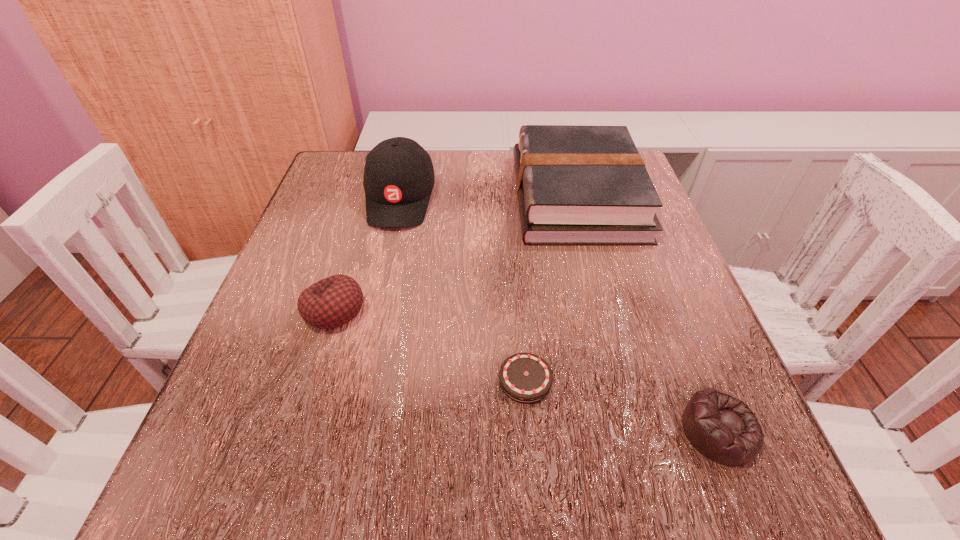
Where is `beanbag present at the right edge`? The height and width of the screenshot is (540, 960). beanbag present at the right edge is located at coordinates (722, 428).

Locate an element on the screen. object that is at the far left corner is located at coordinates (x=398, y=180).

The image size is (960, 540). In order to click on object located at the far right corner in this screenshot , I will do `click(576, 185)`.

Identify the location of object that is at the near right corner. (722, 428).

Identify the location of blank space at the far edge of the desktop. The width and height of the screenshot is (960, 540). (461, 168).

Locate an element on the screen. Image resolution: width=960 pixels, height=540 pixels. vacant space at the near edge is located at coordinates (510, 489).

The height and width of the screenshot is (540, 960). In order to click on vacant space at the left edge of the desktop in this screenshot , I will do `click(292, 276)`.

In the image, there is a desktop. At what (x,y) coordinates should I click in order to perform the action: click on vacant area at the right edge. Please return your answer as a coordinate pair (x, y). The height and width of the screenshot is (540, 960). Looking at the image, I should click on (695, 320).

You are a GUI agent. You are given a task and a screenshot of the screen. Output one action in this format:
    pyautogui.click(x=<x>, y=<y>)
    Task: Click on the vacant area between the left beanbag and the baseball cap
    The image size is (960, 540).
    Given the screenshot: What is the action you would take?
    pyautogui.click(x=367, y=254)

Identify the location of vacant space that is in between the hardback book and the fourth tallest object. (647, 314).